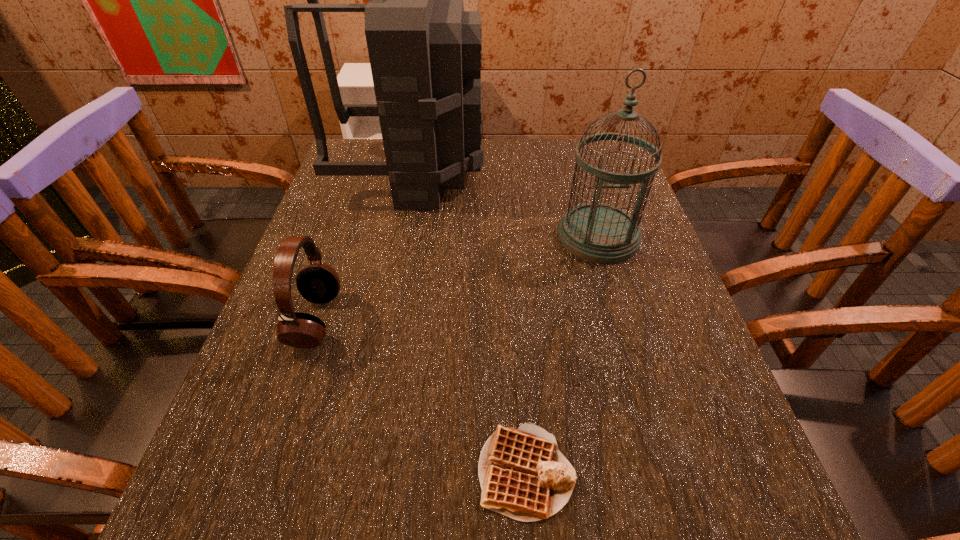
Locate an element on the screen. vacant area at the right edge of the desktop is located at coordinates (622, 275).

Locate an element on the screen. This screenshot has height=540, width=960. vacant area at the far left corner is located at coordinates (387, 180).

At what (x,y) coordinates should I click in order to perform the action: click on free region at the near left corner of the desktop. Please return your answer as a coordinate pair (x, y). Looking at the image, I should click on (265, 503).

Find the location of a particular element. free space at the near right corner of the desktop is located at coordinates [x=742, y=509].

The height and width of the screenshot is (540, 960). What are the coordinates of `free space that is in between the headset and the nearest object` in the screenshot? It's located at (421, 395).

You are a GUI agent. You are given a task and a screenshot of the screen. Output one action in this format:
    pyautogui.click(x=<x>, y=<y>)
    Task: Click on the vacant area that lies between the second nearest object and the tallest object
    This screenshot has width=960, height=540.
    Given the screenshot: What is the action you would take?
    pyautogui.click(x=364, y=246)

Identify the location of empty space between the shortest object and the third farthest object. (421, 395).

At what (x,y) coordinates should I click in order to perform the action: click on vacant space that is in between the backpack and the second nearest object. Please return your answer as a coordinate pair (x, y). This screenshot has height=540, width=960. Looking at the image, I should click on (364, 246).

Find the location of a particular element. This screenshot has width=960, height=540. free spot between the rightmost object and the third tallest object is located at coordinates (457, 278).

Where is `vacant space that's between the headset and the rightmost object`? The height and width of the screenshot is (540, 960). vacant space that's between the headset and the rightmost object is located at coordinates (457, 278).